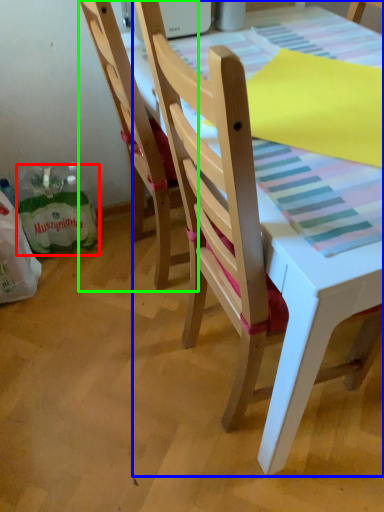
Question: Which is farther away from shopping bag (highlighted by a red box)? chair (highlighted by a blue box) or chair (highlighted by a green box)?

Choices:
 (A) chair
 (B) chair

Answer: (A)